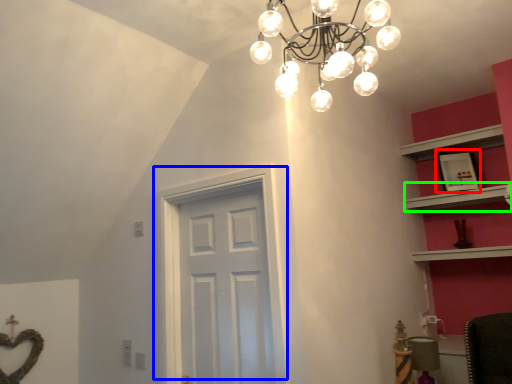
Question: Which object is positioned farthest from picture frame (highlighted by a red box)? Select from door (highlighted by a blue box) and shelf (highlighted by a green box).

Choices:
 (A) door
 (B) shelf

Answer: (A)